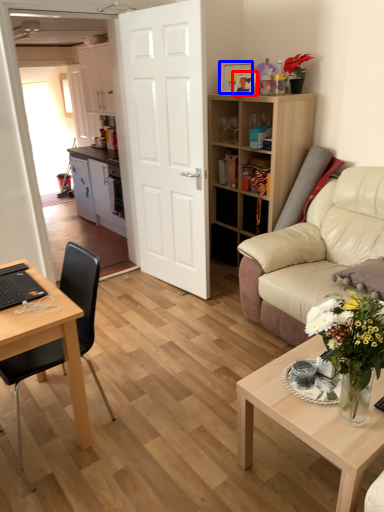
Question: Which object is closer to the camera taking this photo, picture frame (highlighted by a red box) or picture frame (highlighted by a blue box)?

Choices:
 (A) picture frame
 (B) picture frame

Answer: (A)